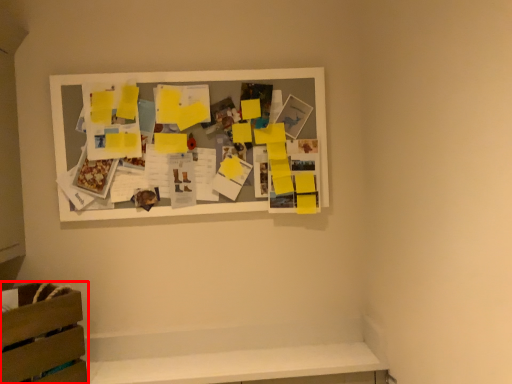
Question: From the image's perspective, what is the correct spatial positioning of furniture (annotated by the red box) in reference to picture frame?

Choices:
 (A) above
 (B) below

Answer: (B)